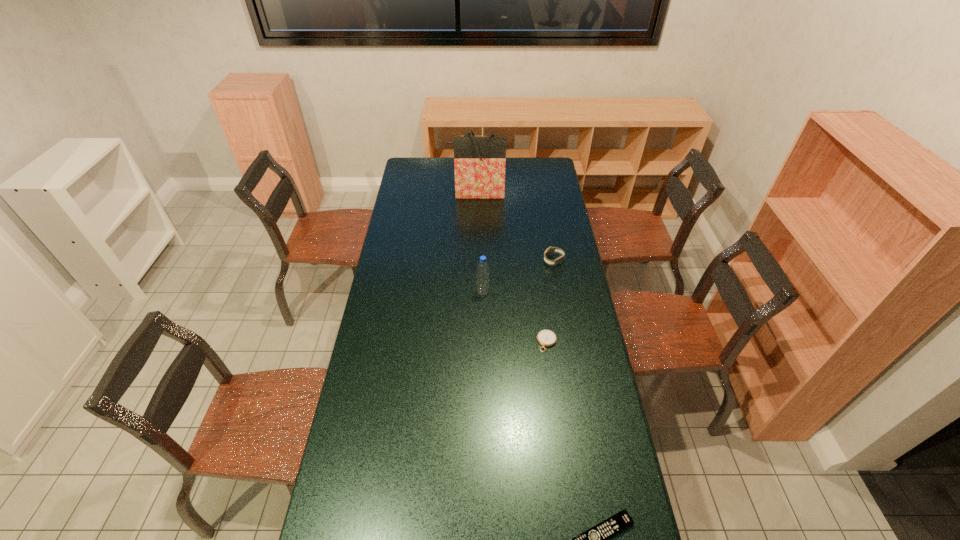
Where is `shopping bag`? The height and width of the screenshot is (540, 960). shopping bag is located at coordinates tap(479, 162).

Where is `the farthest object`? Image resolution: width=960 pixels, height=540 pixels. the farthest object is located at coordinates (479, 162).

The width and height of the screenshot is (960, 540). Find the location of `water bottle`. water bottle is located at coordinates (482, 268).

Where is `the fourth shortest object`? This screenshot has width=960, height=540. the fourth shortest object is located at coordinates (482, 268).

Identify the location of watch. The image size is (960, 540). (549, 251).

You are a GUI agent. You are given a task and a screenshot of the screen. Output one action in this format:
    pyautogui.click(x=<x>, y=<y>)
    Task: Click on the third shortest object
    
    Given the screenshot: What is the action you would take?
    [x=549, y=251]

Where is `the fourth farthest object`? Image resolution: width=960 pixels, height=540 pixels. the fourth farthest object is located at coordinates (546, 338).

The width and height of the screenshot is (960, 540). I want to click on free space located 0.140m on the front side of the tallest object, so click(x=476, y=216).

Locate an element on the screen. Image resolution: width=960 pixels, height=540 pixels. vacant space situated on the front of the third farthest object is located at coordinates (483, 334).

At what (x,y) coordinates should I click in order to perform the action: click on vacant space located on the face of the fourth nearest object. Please return your answer as a coordinate pair (x, y). This screenshot has width=960, height=540. Looking at the image, I should click on (465, 261).